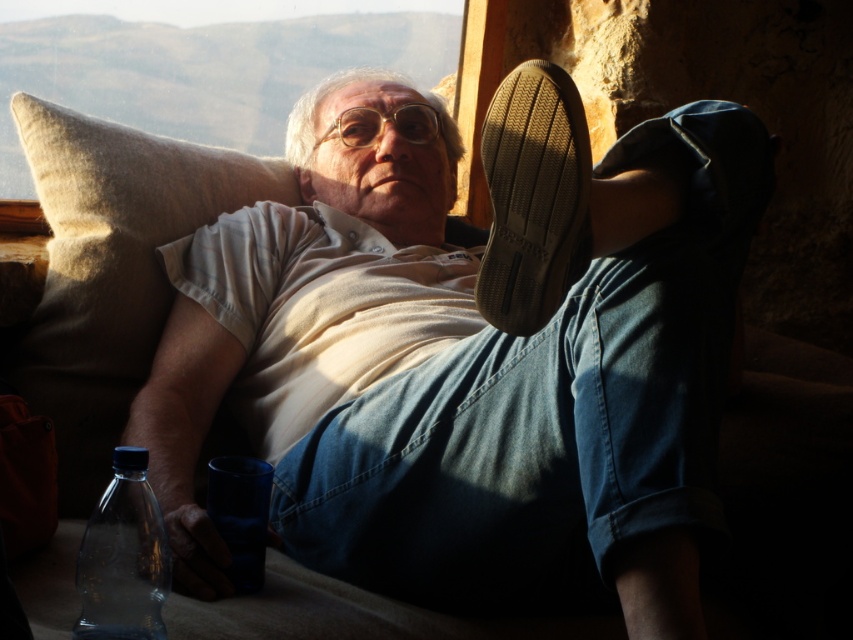
You are a delivery person who needs to place a small package on the table. The package is the same size as the transparent plastic bottle at lower left. Is there enough space next to the transparent glass window at upper center to place it without blocking the view?

The transparent glass window at upper center is larger than the transparent plastic bottle at lower left. Since the package is the same size as the plastic bottle, there should be sufficient space next to the window to place it without blocking the view.

You are a delivery person who just entered the room and need to place a small package on the floor. The room has a brown leather shoe at upper right and a transparent plastic bottle at lower left. Where should you place the package so it doesn t get stepped on?

Place the package near the transparent plastic bottle at lower left because the brown leather shoe at upper right is above it, indicating the shoe is closer to the upper area, so the lower left area is safer from being stepped on.

You are a delivery person entering the room and need to place a small package on the nearest surface. The room has a transparent glass window at upper center and a transparent plastic bottle at lower left. Which object is closer to you so you can place the package there?

The transparent glass window at upper center is closer to you than the transparent plastic bottle at lower left, so you should place the package near the transparent glass window at upper center.